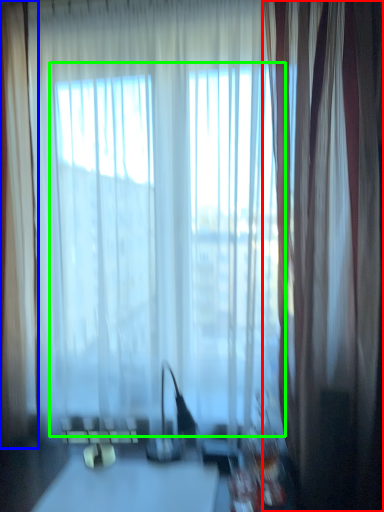
Question: Which object is the farthest from curtain (highlighted by a red box)? Choose among these: curtain (highlighted by a blue box) or bay window (highlighted by a green box).

Choices:
 (A) curtain
 (B) bay window

Answer: (A)